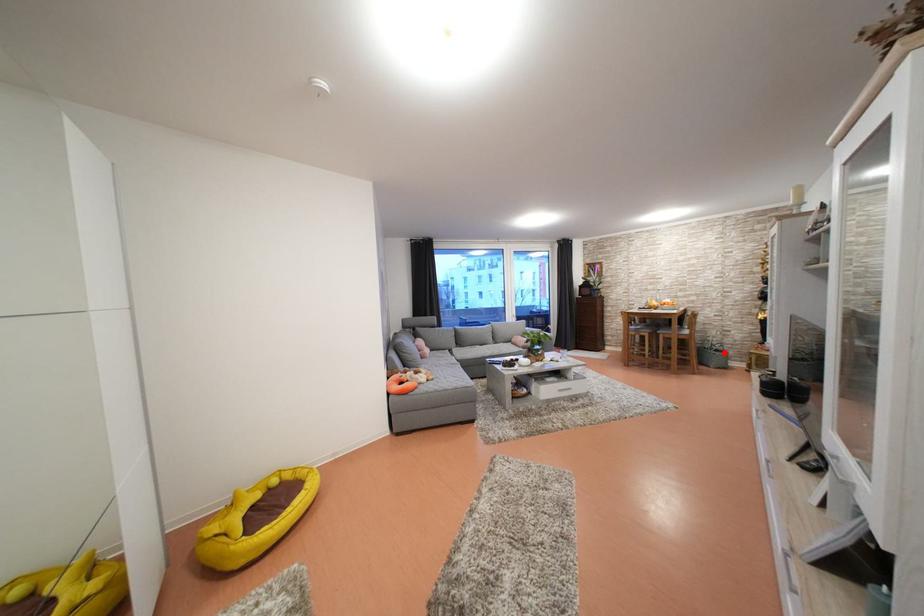
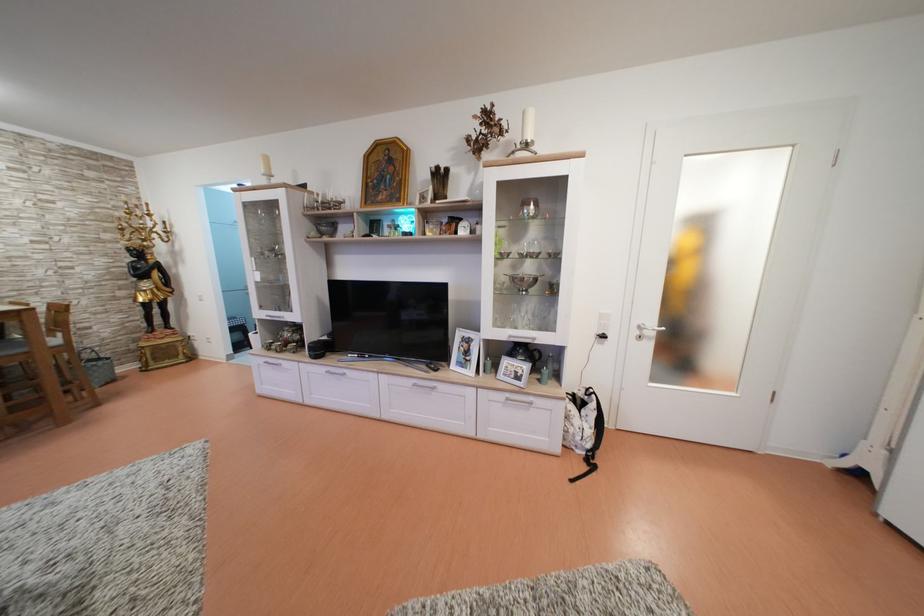
Where in the second image is the point corresponding to the highlighted location from the first image?

(96, 361)